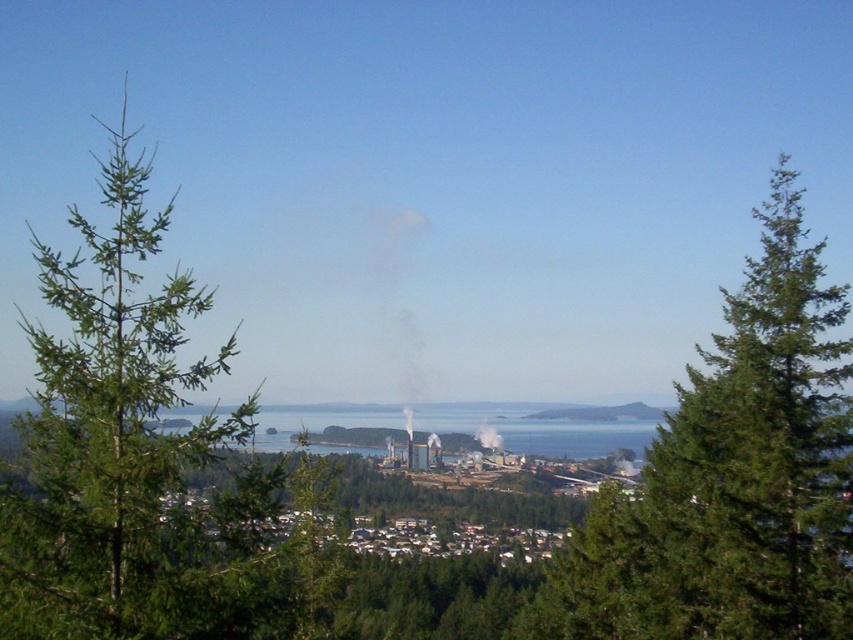
Question: Can you confirm if green textured tree at center is wider than green needle-like tree at left?

Choices:
 (A) no
 (B) yes

Answer: (B)

Question: Among these points, which one is farthest from the camera?

Choices:
 (A) (636, 609)
 (B) (68, 305)

Answer: (A)

Question: Among these points, which one is nearest to the camera?

Choices:
 (A) (798, 392)
 (B) (90, 298)

Answer: (B)

Question: Considering the relative positions of green textured tree at center and green needle-like tree at left in the image provided, where is green textured tree at center located with respect to green needle-like tree at left?

Choices:
 (A) above
 (B) below

Answer: (B)

Question: Observing the image, what is the correct spatial positioning of green textured tree at center in reference to green needle-like tree at left?

Choices:
 (A) below
 (B) above

Answer: (A)

Question: Which point is closer to the camera?

Choices:
 (A) (125, 205)
 (B) (733, 474)

Answer: (A)